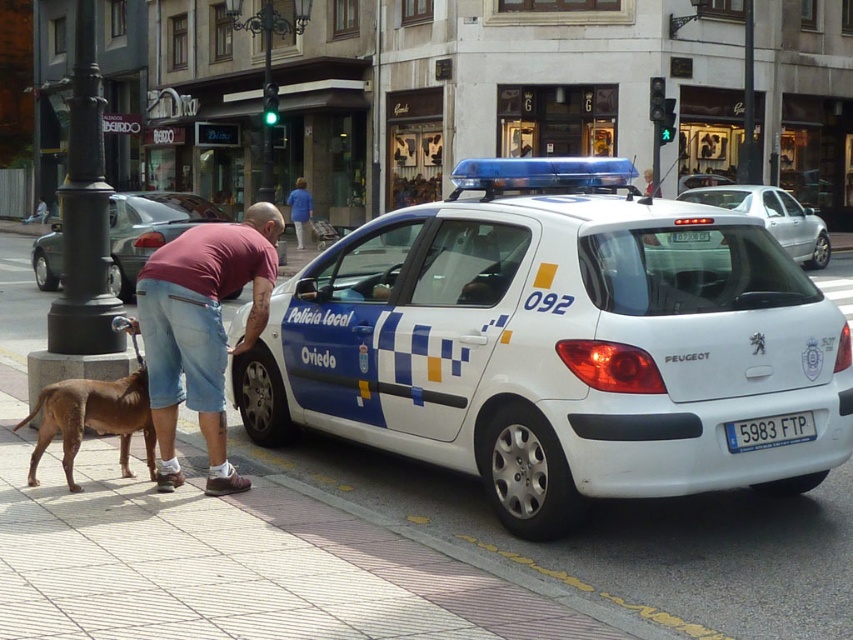
Can you confirm if pink cotton t-shirt at center is bigger than blue metallic license plate at center?

Yes.

Where is `pink cotton t-shirt at center`? pink cotton t-shirt at center is located at coordinates (201, 330).

This screenshot has width=853, height=640. In order to click on pink cotton t-shirt at center in this screenshot , I will do `click(201, 330)`.

What do you see at coordinates (201, 330) in the screenshot? I see `pink cotton t-shirt at center` at bounding box center [201, 330].

From the picture: Can you confirm if pink cotton t-shirt at center is taller than white glossy car at left?

In fact, pink cotton t-shirt at center may be shorter than white glossy car at left.

At what (x,y) coordinates should I click in order to perform the action: click on pink cotton t-shirt at center. Please return your answer as a coordinate pair (x, y). Image resolution: width=853 pixels, height=640 pixels. Looking at the image, I should click on (201, 330).

Is point (213, 218) closer to camera compared to point (810, 232)?

Yes.

Is point (161, 212) behind point (828, 257)?

That is False.

This screenshot has width=853, height=640. What do you see at coordinates (148, 228) in the screenshot?
I see `white glossy car at left` at bounding box center [148, 228].

You are a GUI agent. You are given a task and a screenshot of the screen. Output one action in this format:
    pyautogui.click(x=<x>, y=<y>)
    Task: Click on the white glossy car at left
    This screenshot has height=640, width=853.
    Given the screenshot: What is the action you would take?
    pyautogui.click(x=148, y=228)